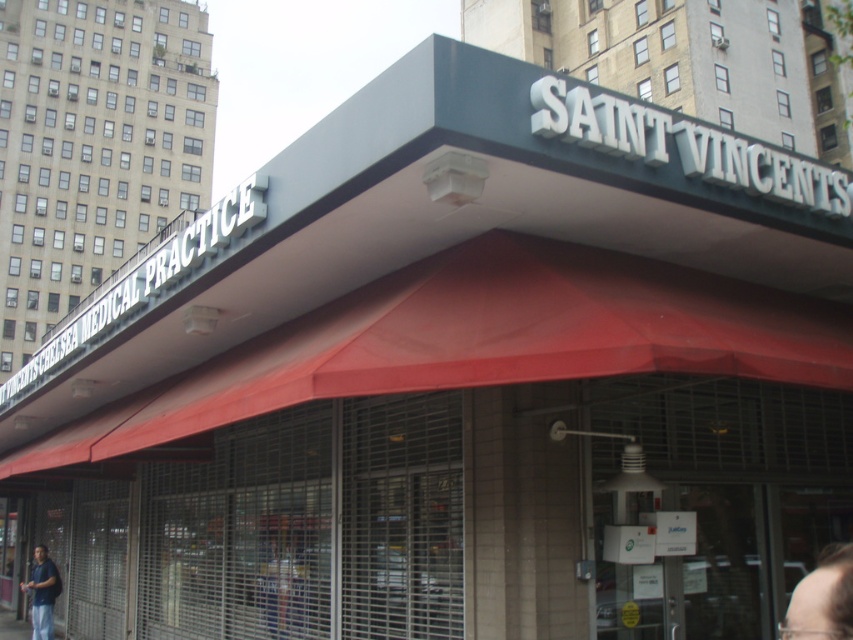
Question: Does dark brown hair at lower right appear on the left side of dark blue shirt at lower left?

Choices:
 (A) yes
 (B) no

Answer: (B)

Question: Can you confirm if dark brown hair at lower right is smaller than dark blue shirt at lower left?

Choices:
 (A) no
 (B) yes

Answer: (B)

Question: Is dark brown hair at lower right to the right of dark blue shirt at lower left from the viewer's perspective?

Choices:
 (A) yes
 (B) no

Answer: (A)

Question: Among these objects, which one is farthest from the camera?

Choices:
 (A) dark brown hair at lower right
 (B) dark blue shirt at lower left

Answer: (B)